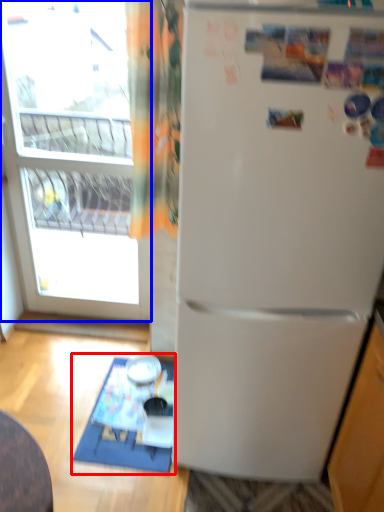
Question: Which of the following is the farthest to the observer, table (highlighted by a red box) or window (highlighted by a blue box)?

Choices:
 (A) table
 (B) window

Answer: (A)